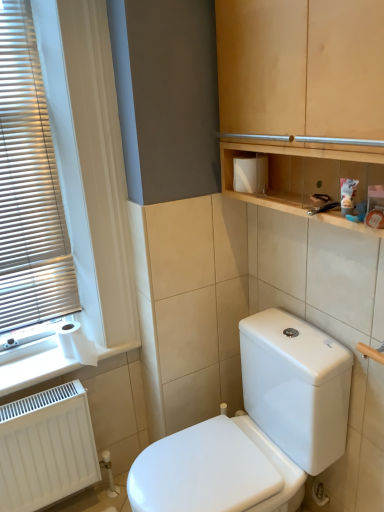
Describe the element at coordinates (46, 448) in the screenshot. I see `white matte radiator at lower left` at that location.

The width and height of the screenshot is (384, 512). I want to click on white paper at lower left, so click(35, 370).

Which object is closer to the camera, wooden cabinet at upper center or white paper at lower left?

wooden cabinet at upper center is more forward.

From the image's perspective, does wooden cabinet at upper center appear higher than white paper at lower left?

Indeed, from the image's perspective, wooden cabinet at upper center is shown above white paper at lower left.

Is there a large distance between wooden cabinet at upper center and white paper at lower left?

wooden cabinet at upper center is positioned a significant distance from white paper at lower left.

What are the coordinates of `window sill below the wooden cabinet at upper center (from the image's perspective)` in the screenshot? It's located at (35, 370).

Considering the positions of objects white plastic blinds at left and white paper at lower left in the image provided, who is more to the right, white plastic blinds at left or white paper at lower left?

From the viewer's perspective, white paper at lower left appears more on the right side.

Is white plastic blinds at left smaller than white paper at lower left?

Incorrect, white plastic blinds at left is not smaller in size than white paper at lower left.

Which object is closer to the camera, white plastic blinds at left or white paper at lower left?

white plastic blinds at left is in front.

Could white paper at lower left be considered to be inside white plastic blinds at left?

Definitely not — white paper at lower left is not inside white plastic blinds at left.

From the image's perspective, between wooden cabinet at upper center and white matte toiletry box at upper center, who is located below?

white matte toiletry box at upper center appears lower in the image.

Considering the points (232, 50) and (242, 181), which point is in front, point (232, 50) or point (242, 181)?

The point (232, 50) is more forward.

Is wooden cabinet at upper center oriented away from white matte toiletry box at upper center?

Yes, wooden cabinet at upper center is facing away from white matte toiletry box at upper center.

Considering the relative sizes of wooden cabinet at upper center and white matte toiletry box at upper center in the image provided, is wooden cabinet at upper center thinner than white matte toiletry box at upper center?

In fact, wooden cabinet at upper center might be wider than white matte toiletry box at upper center.

Is white paper at lower left positioned far away from white matte radiator at lower left?

No, white paper at lower left is in close proximity to white matte radiator at lower left.

From the picture: Is white paper at lower left taller than white matte radiator at lower left?

In fact, white paper at lower left may be shorter than white matte radiator at lower left.

Considering the points (71, 371) and (76, 395), which point is behind, point (71, 371) or point (76, 395)?

Positioned behind is point (71, 371).

Which of these two, white paper at lower left or white glossy toilet at center, is wider?

white glossy toilet at center is wider.

Identify the location of toilet below the white paper at lower left (from a real-world perspective). (256, 426).

Looking at this image, is white paper at lower left to the left of white glossy toilet at center from the viewer's perspective?

Correct, you'll find white paper at lower left to the left of white glossy toilet at center.

Does white paper at lower left touch white glossy toilet at center?

white paper at lower left is not next to white glossy toilet at center, and they're not touching.

Does point (94, 355) come in front of point (237, 177)?

No, (94, 355) is further to viewer.

Consider the image. Are white matte toilet paper at lower left and white matte toiletry box at upper center making contact?

There is a gap between white matte toilet paper at lower left and white matte toiletry box at upper center.

I want to click on toilet paper that appears behind the white matte toiletry box at upper center, so click(76, 343).

From a real-world perspective, is white matte toilet paper at lower left beneath white matte toiletry box at upper center?

Yes, from a real-world perspective, white matte toilet paper at lower left is beneath white matte toiletry box at upper center.

From a real-world perspective, between wooden cabinet at upper center and white plastic blinds at left, who is vertically higher?

From a 3D spatial view, wooden cabinet at upper center is above.

Looking at their sizes, would you say wooden cabinet at upper center is wider or thinner than white plastic blinds at left?

wooden cabinet at upper center is wider than white plastic blinds at left.

In the scene shown: Considering the relative positions of wooden cabinet at upper center and white plastic blinds at left in the image provided, is wooden cabinet at upper center to the left of white plastic blinds at left from the viewer's perspective?

In fact, wooden cabinet at upper center is to the right of white plastic blinds at left.

Considering the relative sizes of wooden cabinet at upper center and white plastic blinds at left in the image provided, is wooden cabinet at upper center shorter than white plastic blinds at left?

Correct, wooden cabinet at upper center is not as tall as white plastic blinds at left.

Identify the location of cabinetry above the white paper at lower left (from a real-world perspective). The width and height of the screenshot is (384, 512). (301, 67).

This screenshot has height=512, width=384. Identify the location of window blind that is above the white paper at lower left (from the image's perspective). (29, 186).

Estimate the real-world distances between objects in this image. Which object is closer to white paper at lower left, white matte toiletry box at upper center or white matte toilet paper at lower left?

white matte toilet paper at lower left is positioned closer to the anchor white paper at lower left.

Looking at the image, which one is located further to wooden cabinet at upper center, white paper at lower left or white glossy toilet at center?

white paper at lower left.

When comparing their distances from wooden cabinet at upper center, does white paper at lower left or white matte radiator at lower left seem closer?

white paper at lower left.

Looking at the image, which one is located further to white matte radiator at lower left, white matte toilet paper at lower left or wooden cabinet at upper center?

wooden cabinet at upper center lies further to white matte radiator at lower left than the other object.

Looking at the image, which one is located further to white paper at lower left, white matte radiator at lower left or wooden cabinet at upper center?

Based on the image, wooden cabinet at upper center appears to be further to white paper at lower left.

From the image, which object appears to be farther from white paper at lower left, white plastic blinds at left or white matte radiator at lower left?

white plastic blinds at left is further to white paper at lower left.

Considering their positions, is white glossy toilet at center positioned closer to white paper at lower left than white plastic blinds at left?

white plastic blinds at left is closer to white paper at lower left.

Based on their spatial positions, is white matte toilet paper at lower left or white paper at lower left further from wooden cabinet at upper center?

white matte toilet paper at lower left lies further to wooden cabinet at upper center than the other object.

Locate an element on the screen. The width and height of the screenshot is (384, 512). toilet paper between white paper at lower left and white matte toiletry box at upper center from left to right is located at coordinates (76, 343).

Find the location of a particular element. Image resolution: width=384 pixels, height=512 pixels. toiletry box located between white plastic blinds at left and wooden cabinet at upper center in the left-right direction is located at coordinates (250, 174).

Find the location of `toilet paper between white plastic blinds at left and wooden cabinet at upper center in the horizontal direction`. toilet paper between white plastic blinds at left and wooden cabinet at upper center in the horizontal direction is located at coordinates tap(76, 343).

I want to click on toilet between white matte toiletry box at upper center and white matte radiator at lower left from top to bottom, so click(256, 426).